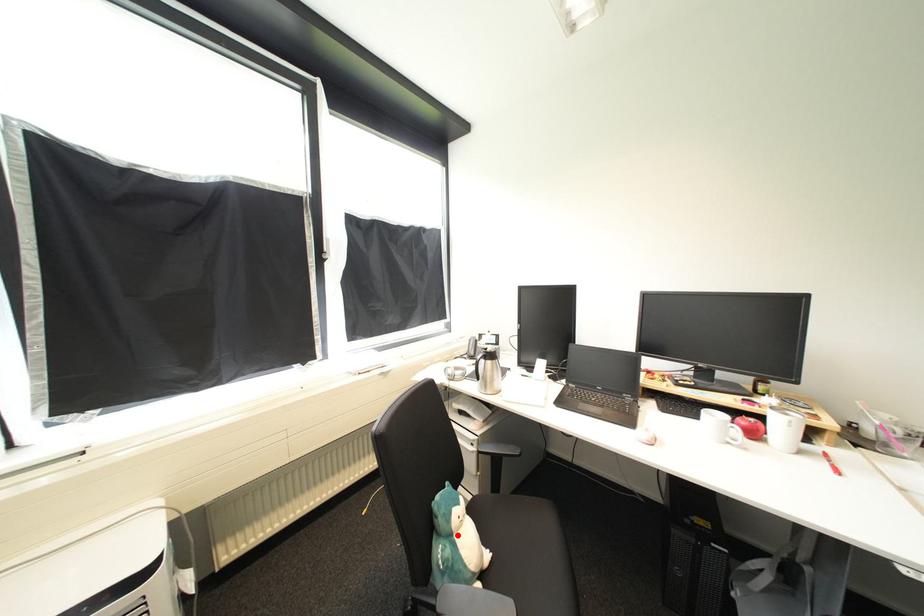
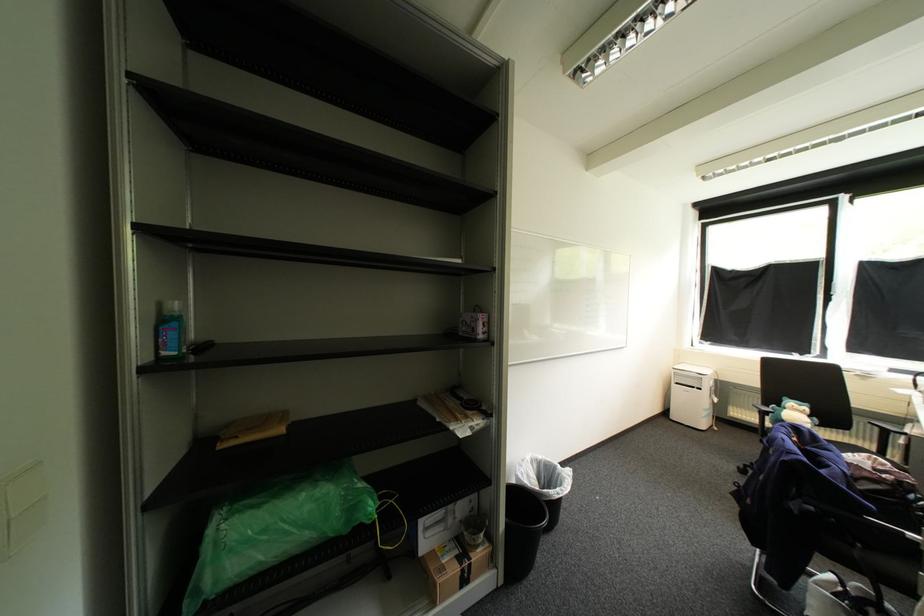
In the second image, find the point that corresponds to the highlighted location in the first image.

(792, 408)